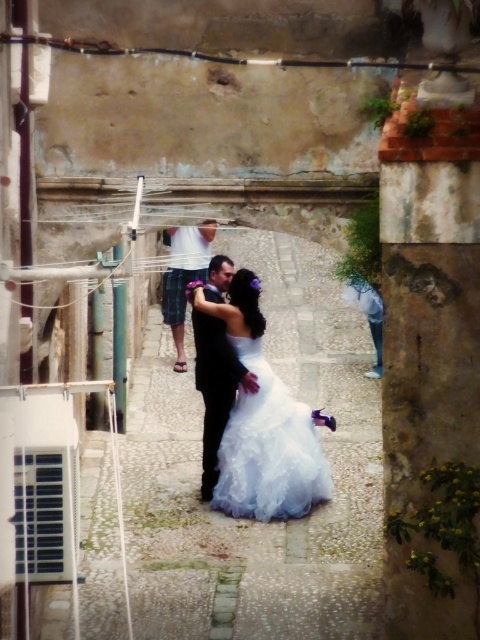
Question: Which point is closer to the camera?

Choices:
 (A) (253, 508)
 (B) (165, 298)
 (C) (225, 282)

Answer: (A)

Question: Does black satin suit at center have a lesser width compared to matte white shirt at center?

Choices:
 (A) no
 (B) yes

Answer: (B)

Question: Based on their relative distances, which object is farther from the white satin dress at center?

Choices:
 (A) white lace dress at center
 (B) black satin suit at center

Answer: (B)

Question: Is white lace dress at center to the left of black satin suit at center from the viewer's perspective?

Choices:
 (A) no
 (B) yes

Answer: (A)

Question: Which object is closer to the camera taking this photo?

Choices:
 (A) matte white shirt at center
 (B) white satin dress at center

Answer: (A)

Question: Does white lace dress at center have a lesser width compared to matte white shirt at center?

Choices:
 (A) yes
 (B) no

Answer: (B)